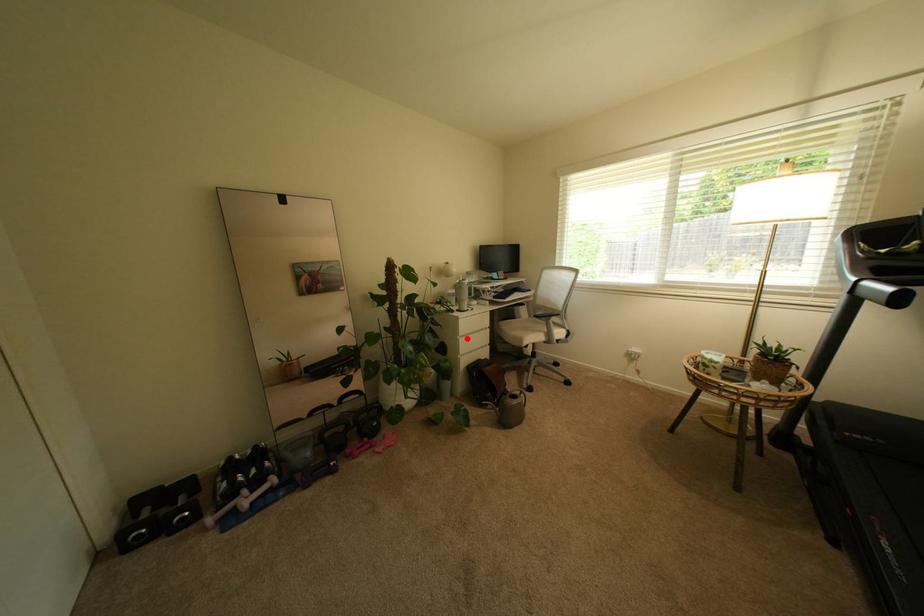
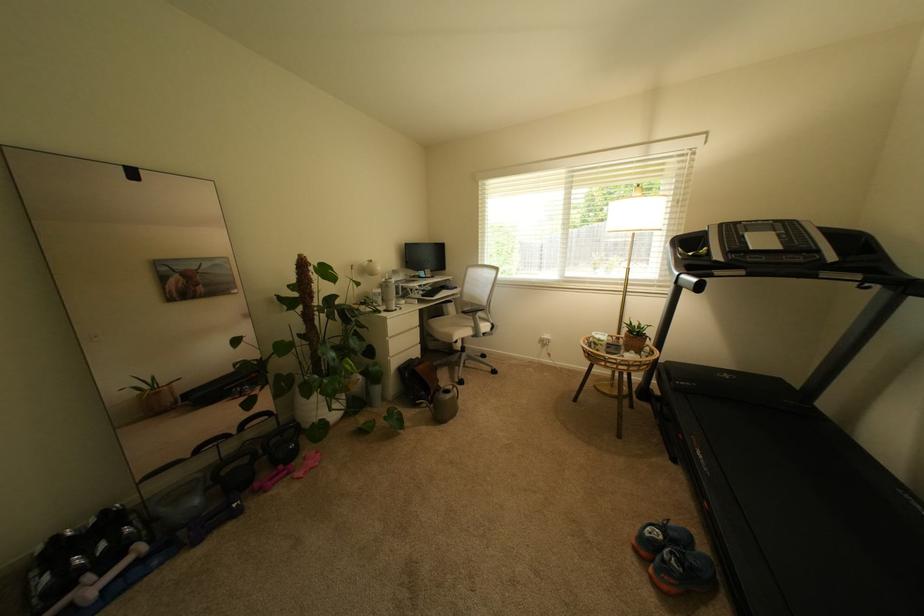
Question: I am providing you with two images of the same scene from different viewpoints. A red point is shown in image1. For the corresponding object point in image2, is it positioned nearer or farther from the camera?

Choices:
 (A) Nearer
 (B) Farther

Answer: (A)